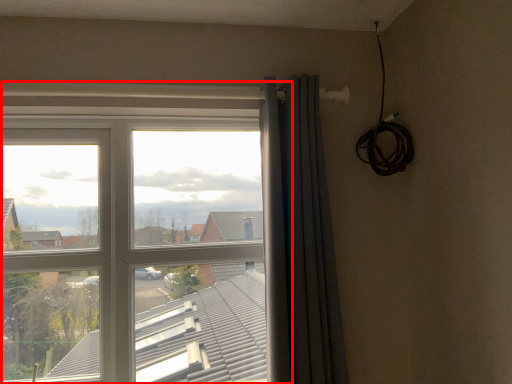
Question: From the image, what is the correct spatial relationship of window (annotated by the red box) in relation to curtain?

Choices:
 (A) right
 (B) left

Answer: (B)